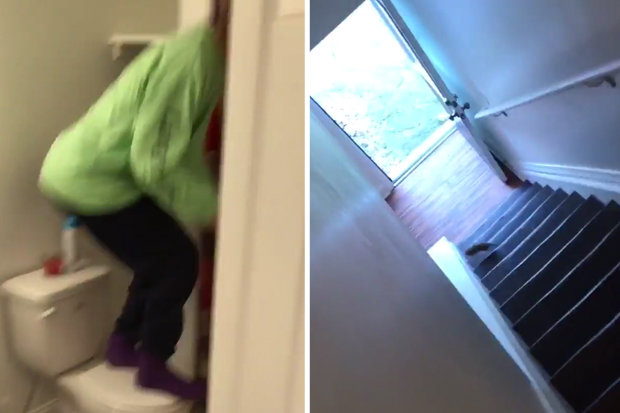
At what (x,y) coordinates should I click in order to perform the action: click on doorknob. Please return your answer as a coordinate pair (x, y). The height and width of the screenshot is (413, 620). Looking at the image, I should click on (467, 104), (453, 116).